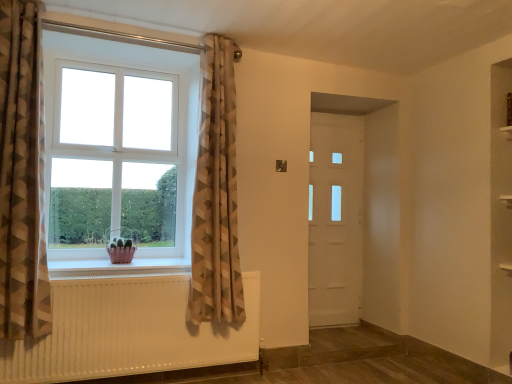
Question: Considering the relative sizes of pink plastic basket at lower left and white textured radiator at lower left in the image provided, is pink plastic basket at lower left thinner than white textured radiator at lower left?

Choices:
 (A) yes
 (B) no

Answer: (B)

Question: Can you confirm if pink plastic basket at lower left is wider than white textured radiator at lower left?

Choices:
 (A) no
 (B) yes

Answer: (B)

Question: Is pink plastic basket at lower left facing away from white textured radiator at lower left?

Choices:
 (A) no
 (B) yes

Answer: (A)

Question: From a real-world perspective, is pink plastic basket at lower left under white textured radiator at lower left?

Choices:
 (A) yes
 (B) no

Answer: (B)

Question: Is pink plastic basket at lower left facing towards white textured radiator at lower left?

Choices:
 (A) no
 (B) yes

Answer: (B)

Question: Considering the relative sizes of pink plastic basket at lower left and white textured radiator at lower left in the image provided, is pink plastic basket at lower left bigger than white textured radiator at lower left?

Choices:
 (A) no
 (B) yes

Answer: (A)

Question: Is white textured radiator at lower left oriented towards pink plastic basket at lower left?

Choices:
 (A) no
 (B) yes

Answer: (A)

Question: From the image's perspective, would you say white textured radiator at lower left is positioned over pink plastic basket at lower left?

Choices:
 (A) yes
 (B) no

Answer: (B)

Question: Does white textured radiator at lower left have a smaller size compared to pink plastic basket at lower left?

Choices:
 (A) no
 (B) yes

Answer: (A)

Question: Can pink plastic basket at lower left be found inside white textured radiator at lower left?

Choices:
 (A) yes
 (B) no

Answer: (B)

Question: Considering the relative sizes of white textured radiator at lower left and pink plastic basket at lower left in the image provided, is white textured radiator at lower left thinner than pink plastic basket at lower left?

Choices:
 (A) no
 (B) yes

Answer: (B)

Question: From the image's perspective, would you say white textured radiator at lower left is shown under pink plastic basket at lower left?

Choices:
 (A) yes
 (B) no

Answer: (A)

Question: Is white plastic window at left to the right of white textured radiator at lower left from the viewer's perspective?

Choices:
 (A) no
 (B) yes

Answer: (A)